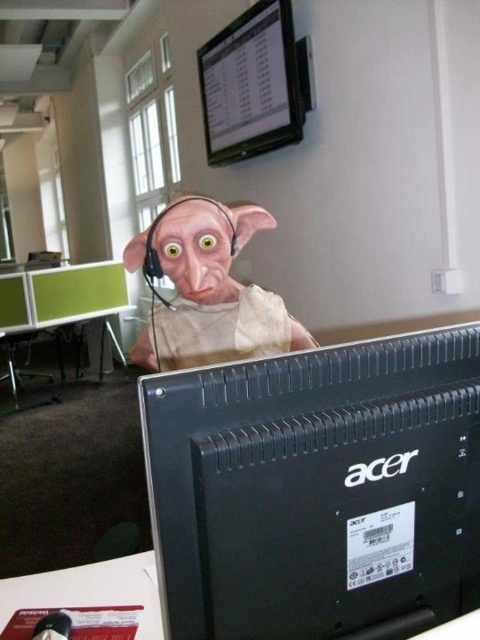
Question: Can you confirm if matte beige mask at center is bigger than white plastic computer desk at lower left?

Choices:
 (A) yes
 (B) no

Answer: (A)

Question: Which object appears farthest from the camera in this image?

Choices:
 (A) matte plastic monitor at upper center
 (B) white plastic computer desk at lower left
 (C) black plastic monitor at center

Answer: (A)

Question: Which point is closer to the camera?

Choices:
 (A) (213, 468)
 (B) (265, 312)
 (C) (154, 621)
 (D) (74, 296)

Answer: (A)

Question: Is matte plastic monitor at upper center bigger than white plastic computer desk at lower left?

Choices:
 (A) no
 (B) yes

Answer: (B)

Question: Is white plastic computer desk at lower left smaller than green plastic desk at center?

Choices:
 (A) yes
 (B) no

Answer: (A)

Question: Estimate the real-world distances between objects in this image. Which object is farther from the white plastic computer desk at lower left?

Choices:
 (A) matte plastic monitor at upper center
 (B) black plastic monitor at center
 (C) green plastic desk at center

Answer: (C)